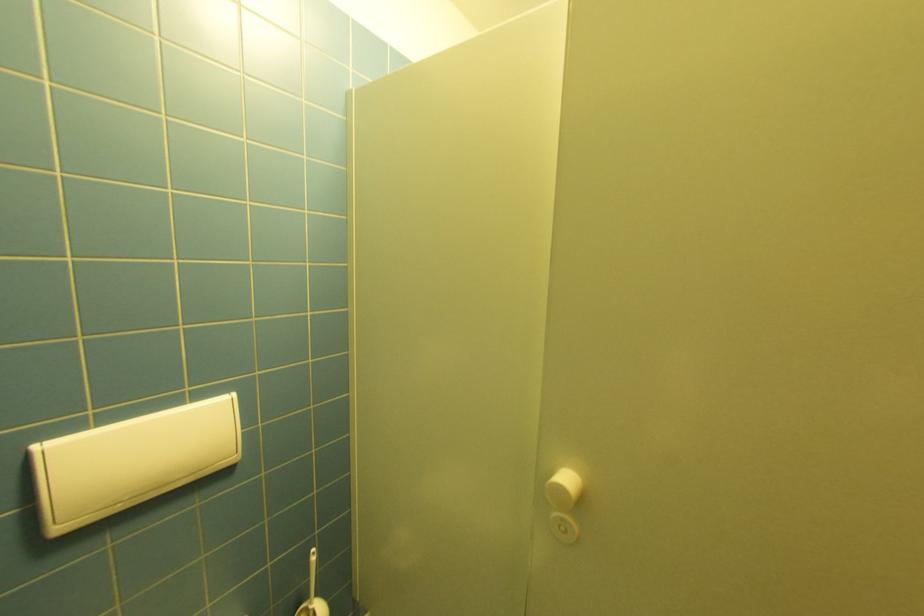
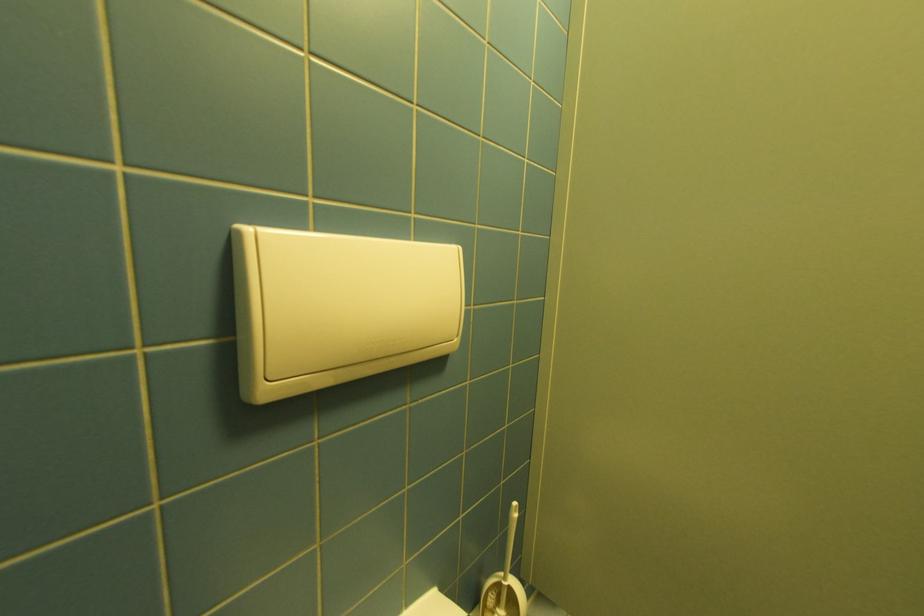
Question: The images are taken continuously from a first-person perspective. In which direction is your viewpoint rotating?

Choices:
 (A) Left
 (B) Right
 (C) Up
 (D) Down

Answer: (A)